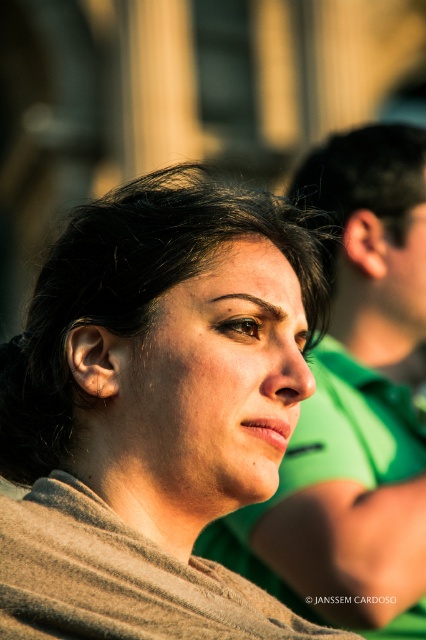
You are a photographer adjusting the lighting for a portrait. You notice the matte gray scarf at center and the dark brown hair at upper center in the frame. Which object should you focus the light on if you want to highlight the wider one?

The matte gray scarf at center might be wider than dark brown hair at upper center, so you should focus the light on the matte gray scarf at center to highlight the wider object.

You are standing in front of a photo of a woman wearing a light brown textured garment. There is a point at coordinates point [331,452] in the image. If you want to know how far this point is from you, what would you say?

The distance of point [331,452] from the camera is 56.81 meters.

You are an artist sketching this scene. You need to decide which object to draw first based on their size. According to the scene, which one is wider, the green fabric shirt at right or the matte black forehead at upper center?

The green fabric shirt at right is wider than the matte black forehead at upper center according to the description.